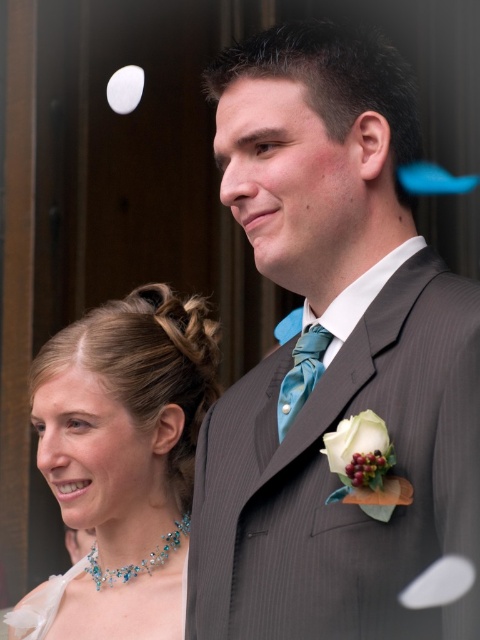
Between pearl necklace at upper left and teal satin tie at center, which one appears on the left side from the viewer's perspective?

pearl necklace at upper left is more to the left.

Is pearl necklace at upper left positioned at the back of teal satin tie at center?

Yes, it is behind teal satin tie at center.

At what (x,y) coordinates should I click in order to perform the action: click on pearl necklace at upper left. Please return your answer as a coordinate pair (x, y). The width and height of the screenshot is (480, 640). Looking at the image, I should click on (126, 452).

Which of these two, teal satin tie at center or shiny blue gemstone necklace at lower left, stands taller?

teal satin tie at center is taller.

Is point (299, 365) positioned before point (94, 544)?

Yes, it is.

Where is `teal satin tie at center`? teal satin tie at center is located at coordinates (300, 374).

Is point (324, 186) positioned before point (141, 400)?

Yes, point (324, 186) is in front of point (141, 400).

Is the position of gray pinstripe suit at center less distant than that of pearl necklace at upper left?

Yes, it is in front of pearl necklace at upper left.

Does point (275, 582) lie behind point (192, 332)?

No, (275, 582) is closer to viewer.

The image size is (480, 640). I want to click on gray pinstripe suit at center, so click(334, 355).